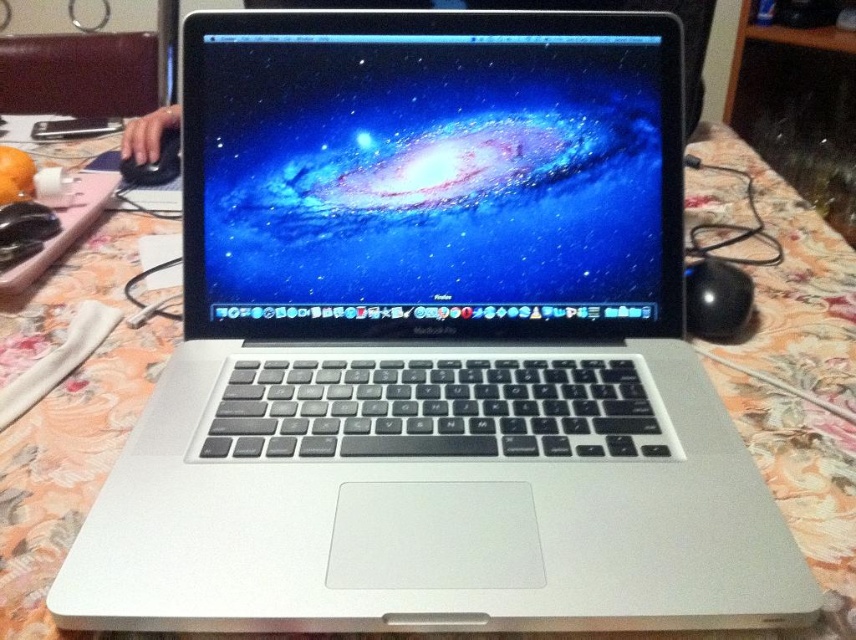
You are sitting on the brown leather couch at upper left and want to reach the black matte mouse at left. Based on their positions, can you easily grab the mouse without moving from the couch?

The brown leather couch at upper left is located above the black matte mouse at left, so you are physically higher than the mouse. Since you are sitting on the couch, you might need to lean forward or move closer to reach the mouse, making it a bit challenging to grab it easily without shifting your position.

You are a photographer taking a closeup shot of the MacBook Pro laptop. You want to focus on the point at coordinates point (123, 61) and point (146, 176). Which point is closer to your camera lens?

Point (123, 61) is further to the viewer than point (146, 176), so the point closer to the camera lens is point (146, 176).

You are organizing a small event and need to place a 1.5 meter long banner on the table where the MacBook Pro is located. Considering the objects present, will there be enough space between the brown leather couch at upper left and the black matte mouse at left to accommodate the banner?

The brown leather couch at upper left is larger in size than the black matte mouse at left, but the exact distance between them isn